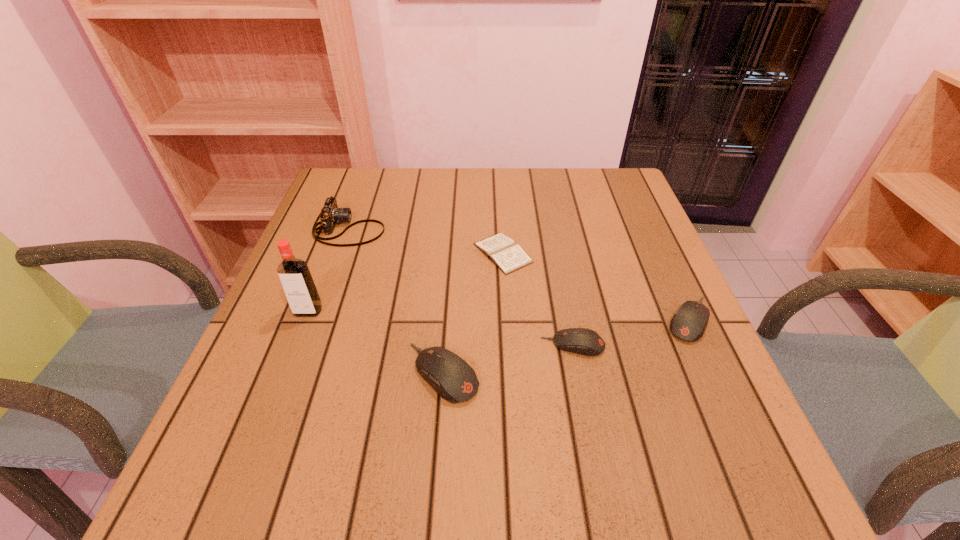
The height and width of the screenshot is (540, 960). Identify the location of blank space at the far edge of the desktop. (409, 198).

This screenshot has width=960, height=540. I want to click on free point at the near edge, so click(377, 424).

Image resolution: width=960 pixels, height=540 pixels. What are the coordinates of `vacant space at the left edge` in the screenshot? It's located at click(274, 362).

In the image, there is a desktop. Find the location of `vacant space at the right edge`. vacant space at the right edge is located at coordinates (656, 253).

In the image, there is a desktop. Identify the location of blank space at the far right corner. The height and width of the screenshot is (540, 960). (614, 192).

This screenshot has height=540, width=960. Identify the location of free spot between the shortest object and the camera. (426, 241).

Find the location of `vacant space that is in between the second tallest computer mouse and the diary`. vacant space that is in between the second tallest computer mouse and the diary is located at coordinates (596, 286).

Locate an element on the screen. Image resolution: width=960 pixels, height=540 pixels. free space between the shortest computer mouse and the camera is located at coordinates (461, 287).

This screenshot has width=960, height=540. I want to click on free space between the tallest object and the camera, so click(329, 270).

Find the location of a particular element. This screenshot has width=960, height=540. empty location between the vodka and the shortest computer mouse is located at coordinates (441, 328).